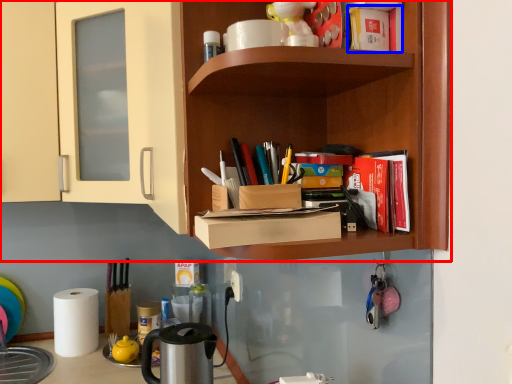
Question: Which of the following is the closest to the observer, shelf (highlighted by a red box) or book (highlighted by a blue box)?

Choices:
 (A) shelf
 (B) book

Answer: (B)